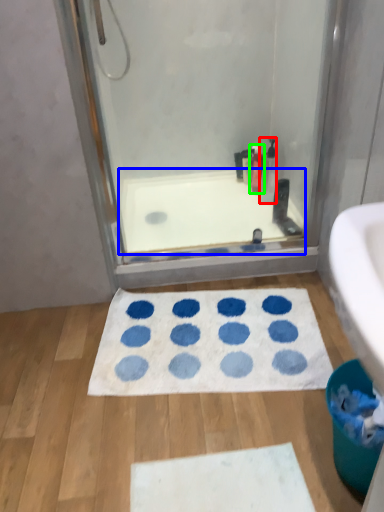
Question: Which object is the farthest from cleaning product (highlighted by a red box)? Choose among these: bath (highlighted by a blue box) or cleaning product (highlighted by a green box).

Choices:
 (A) bath
 (B) cleaning product

Answer: (A)